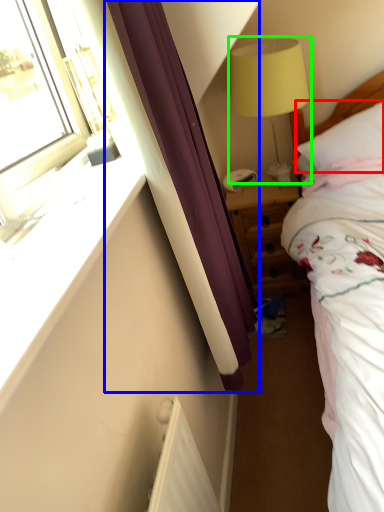
Question: Which is nearer to the pillow (highlighted by a red box)? curtain (highlighted by a blue box) or table lamp (highlighted by a green box).

Choices:
 (A) curtain
 (B) table lamp

Answer: (B)